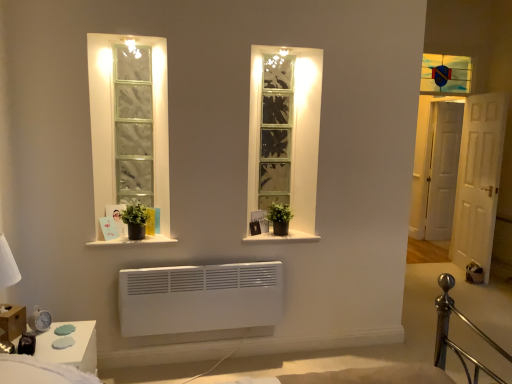
At what (x,y) coordinates should I click in order to perform the action: click on matte brown wooden box at lower left. Please return your answer as a coordinate pair (x, y). The height and width of the screenshot is (384, 512). Looking at the image, I should click on (12, 322).

This screenshot has height=384, width=512. Identify the location of white matte window sill at center, which is the first window sill in left-to-right order. (133, 241).

I want to click on white wooden door at right, which appears as the first door when viewed from the front, so click(478, 180).

Where is `white glossy window sill at center, acting as the 2th window sill starting from the left`? The width and height of the screenshot is (512, 384). white glossy window sill at center, acting as the 2th window sill starting from the left is located at coordinates (282, 237).

Locate an element on the screen. Image resolution: width=512 pixels, height=384 pixels. white glossy side table at lower left is located at coordinates (72, 346).

This screenshot has height=384, width=512. Describe the element at coordinates (72, 346) in the screenshot. I see `white glossy side table at lower left` at that location.

In order to face green matte plant at center, should I rotate leftwards or rightwards?

Turn right by 3.365 degrees to look at green matte plant at center.

The height and width of the screenshot is (384, 512). Describe the element at coordinates (279, 213) in the screenshot. I see `green matte plant at center` at that location.

At what (x,y) coordinates should I click in order to perform the action: click on matte brown wooden box at lower left. Please return your answer as a coordinate pair (x, y). Image resolution: width=512 pixels, height=384 pixels. Looking at the image, I should click on (12, 322).

Is white glossy side table at lower left located outside white wooden door at right, which appears as the first door when viewed from the front?

Yes, white glossy side table at lower left is not within white wooden door at right, which appears as the first door when viewed from the front.

Is white glossy side table at lower left looking in the opposite direction of white wooden door at right, arranged as the 1th door when viewed from the left?

white glossy side table at lower left is not turned away from white wooden door at right, arranged as the 1th door when viewed from the left.

From the image's perspective, which one is positioned lower, white glossy side table at lower left or white wooden door at right, which appears as the first door when viewed from the front?

From the image's view, white glossy side table at lower left is below.

Considering the sizes of objects white glossy side table at lower left and white wooden door at right, which appears as the first door when viewed from the front, in the image provided, who is shorter, white glossy side table at lower left or white wooden door at right, which appears as the first door when viewed from the front,?

white glossy side table at lower left is shorter.

Is matte brown wooden box at lower left positioned beyond the bounds of clear glass window at center?

matte brown wooden box at lower left is positioned outside clear glass window at center.

Which is more to the left, matte brown wooden box at lower left or clear glass window at center?

Positioned to the left is matte brown wooden box at lower left.

Can you confirm if matte brown wooden box at lower left is wider than clear glass window at center?

No, matte brown wooden box at lower left is not wider than clear glass window at center.

Which point is more forward, (x=10, y=329) or (x=285, y=187)?

The point (x=10, y=329) is closer.

Between point (144, 240) and point (250, 236), which one is positioned in front?

The point (144, 240) is in front.

Between white matte window sill at center, placed as the 2th window sill when sorted from right to left, and white glossy window sill at center, acting as the 2th window sill starting from the left, which one has less height?

With less height is white glossy window sill at center, acting as the 2th window sill starting from the left.

Considering the positions of point (0, 324) and point (271, 210), is point (0, 324) closer or farther from the camera than point (271, 210)?

Clearly, point (0, 324) is closer to the camera than point (271, 210).

Is green matte plant at center at the back of matte brown wooden box at lower left?

No, matte brown wooden box at lower left's orientation is not away from green matte plant at center.

Which object is positioned more to the right, matte brown wooden box at lower left or green matte plant at center?

Positioned to the right is green matte plant at center.

Considering the relative positions of white matte door at right, which is counted as the 1th door, starting from the back, and stained glass window at upper right in the image provided, is white matte door at right, which is counted as the 1th door, starting from the back, to the left or to the right of stained glass window at upper right?

white matte door at right, which is counted as the 1th door, starting from the back, is positioned on stained glass window at upper right's right side.

Consider the image. Is stained glass window at upper right surrounded by white matte door at right, which is counted as the 1th door, starting from the back?

No, stained glass window at upper right is located outside of white matte door at right, which is counted as the 1th door, starting from the back.

Is white matte door at right, the second door positioned from the front, far from stained glass window at upper right?

No.

Could you tell me if white matte door at right, the second door positioned from the front, is facing stained glass window at upper right?

No, white matte door at right, the second door positioned from the front, is not turned towards stained glass window at upper right.

In the scene shown: From the image's perspective, is green matte plant at center located above white matte window sill at center, placed as the 2th window sill when sorted from right to left?

Yes, from the image's perspective, green matte plant at center is over white matte window sill at center, placed as the 2th window sill when sorted from right to left.

Is green matte plant at center to the left or to the right of white matte window sill at center, placed as the 2th window sill when sorted from right to left, in the image?

green matte plant at center is to the right of white matte window sill at center, placed as the 2th window sill when sorted from right to left.

Which is in front, green matte plant at center or white matte window sill at center, placed as the 2th window sill when sorted from right to left?

white matte window sill at center, placed as the 2th window sill when sorted from right to left, is more forward.

The image size is (512, 384). I want to click on the 2nd window sill positioned below the green matte plant at center (from the image's perspective), so click(133, 241).

Is white matte door at right, the second door positioned from the front, smaller than white glossy window sill at center, acting as the 2th window sill starting from the left?

No.

In terms of height, does white matte door at right, which appears as the second door when viewed from the left, look taller or shorter compared to white glossy window sill at center, which appears as the 1th window sill when viewed from the right?

Clearly, white matte door at right, which appears as the second door when viewed from the left, is taller compared to white glossy window sill at center, which appears as the 1th window sill when viewed from the right.

Can you tell me how much white matte door at right, the 1th door when ordered from right to left, and white glossy window sill at center, which appears as the 1th window sill when viewed from the right, differ in facing direction?

There is a 5.65-degree angle between the facing directions of white matte door at right, the 1th door when ordered from right to left, and white glossy window sill at center, which appears as the 1th window sill when viewed from the right.

Is white matte door at right, which is counted as the 1th door, starting from the back, turned away from white glossy window sill at center, acting as the 2th window sill starting from the left?

No, white matte door at right, which is counted as the 1th door, starting from the back, is not facing away from white glossy window sill at center, acting as the 2th window sill starting from the left.

What are the coordinates of `furniture on the left of white wooden door at right, arranged as the 1th door when viewed from the left` in the screenshot? It's located at (72, 346).

Where is `window box that is below the clear glass window at center (from the image's perspective)`? Image resolution: width=512 pixels, height=384 pixels. window box that is below the clear glass window at center (from the image's perspective) is located at coordinates (12, 322).

From the image, which object appears to be nearer to white matte door at right, which appears as the second door when viewed from the left, white glossy window sill at center, acting as the 2th window sill starting from the left, or white glossy side table at lower left?

white glossy window sill at center, acting as the 2th window sill starting from the left, is positioned closer to the anchor white matte door at right, which appears as the second door when viewed from the left.

Looking at this image, considering their positions, is stained glass window at upper right positioned closer to matte brown wooden box at lower left than white glossy side table at lower left?

white glossy side table at lower left is closer to matte brown wooden box at lower left.

Which object lies further to the anchor point stained glass window at upper right, clear glass window at center or white matte door at right, the second door positioned from the front?

Among the two, clear glass window at center is located further to stained glass window at upper right.

When comparing their distances from white glossy side table at lower left, does white matte window sill at center, which is the first window sill in left-to-right order, or white matte door at right, the second door positioned from the front, seem closer?

Based on the image, white matte window sill at center, which is the first window sill in left-to-right order, appears to be nearer to white glossy side table at lower left.

Looking at the image, which one is located further to white matte door at right, the 1th door when ordered from right to left, clear glass window at center or green matte plant at center?

Among the two, green matte plant at center is located further to white matte door at right, the 1th door when ordered from right to left.

Considering their positions, is white glossy window sill at center, acting as the 2th window sill starting from the left, positioned closer to white matte door at right, the second door positioned from the front, than white wooden door at right, arranged as the 1th door when viewed from the left?

white wooden door at right, arranged as the 1th door when viewed from the left, is positioned closer to the anchor white matte door at right, the second door positioned from the front.

Estimate the real-world distances between objects in this image. Which object is further from green matte plant at center, white matte door at right, which appears as the second door when viewed from the left, or clear glass window at center?

white matte door at right, which appears as the second door when viewed from the left, lies further to green matte plant at center than the other object.

When comparing their distances from white matte window sill at center, placed as the 2th window sill when sorted from right to left, does clear glass window at center or green matte plant at center seem further?

Among the two, clear glass window at center is located further to white matte window sill at center, placed as the 2th window sill when sorted from right to left.

Locate an element on the screen. This screenshot has width=512, height=384. window sill between clear glass window at center and white wooden door at right, arranged as the 1th door when viewed from the left, from left to right is located at coordinates (282, 237).

You are a GUI agent. You are given a task and a screenshot of the screen. Output one action in this format:
    pyautogui.click(x=<x>, y=<y>)
    Task: Click on the furniture between matte brown wooden box at lower left and stained glass window at upper right
    
    Given the screenshot: What is the action you would take?
    pyautogui.click(x=72, y=346)

Find the location of `bay window between white matte window sill at center, placed as the 2th window sill when sorted from right to left, and green matte plant at center from left to right`. bay window between white matte window sill at center, placed as the 2th window sill when sorted from right to left, and green matte plant at center from left to right is located at coordinates click(276, 130).

Find the location of a particular element. This screenshot has width=512, height=384. window between white wooden door at right, which is the 2th door in back-to-front order, and white matte door at right, which is counted as the 1th door, starting from the back, from front to back is located at coordinates (446, 74).